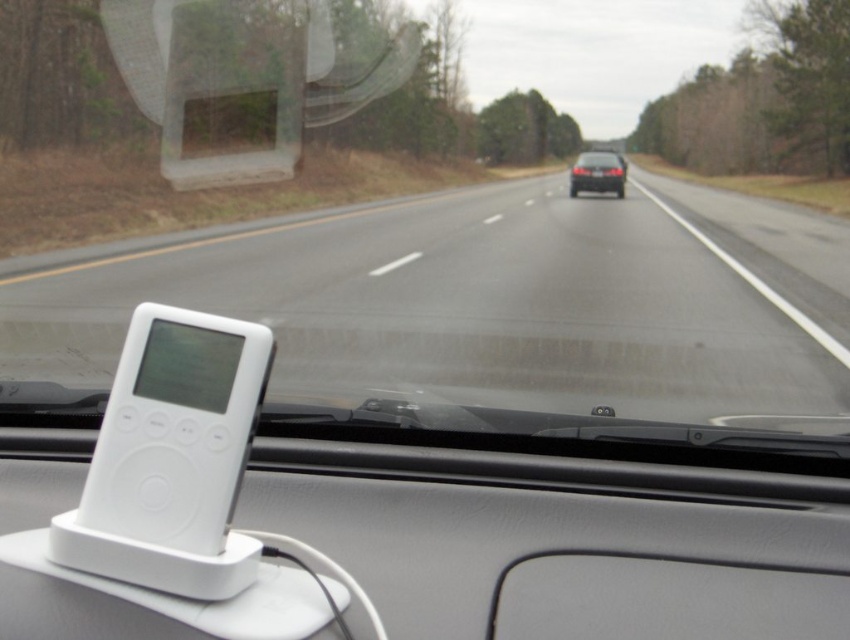
You are driving a car and notice two white devices on the dashboard. One is labeled as the white plastic device at center, and the other is the white matte ipod at center. Which device is positioned to the right side of the dashboard?

The white plastic device at center is to the right of the white matte ipod at center, so the white plastic device at center is positioned to the right side of the dashboard.

You are a passenger in the car and want to check the GPS on the white matte ipod at center while also keeping an eye on the black glossy sedan at center ahead. Which object is closer to the driver side window?

The white matte ipod at center is positioned on the left side of black glossy sedan at center, so the white matte ipod at center is closer to the driver side window.